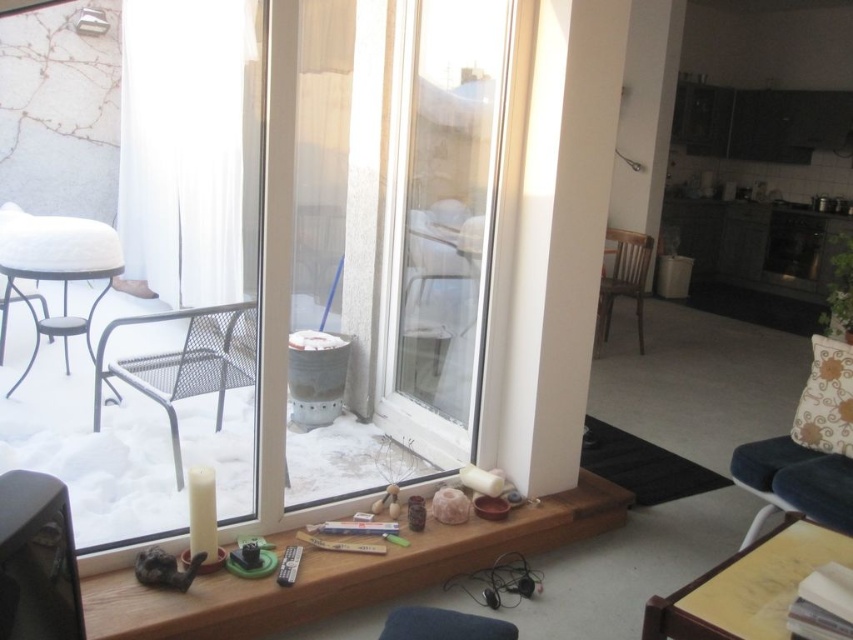
Who is lower down, velvet blue armchair at right or metal mesh armchair at left?

velvet blue armchair at right

Can you confirm if velvet blue armchair at right is positioned to the left of metal mesh armchair at left?

No, velvet blue armchair at right is not to the left of metal mesh armchair at left.

Who is more distant from viewer, (x=809, y=481) or (x=170, y=392)?

Point (x=170, y=392)

Find the location of a particular element. The height and width of the screenshot is (640, 853). velvet blue armchair at right is located at coordinates (805, 444).

This screenshot has height=640, width=853. Describe the element at coordinates (259, 252) in the screenshot. I see `transparent glass window at center` at that location.

Is transparent glass window at center positioned before wooden chair at center?

Yes, it is.

Measure the distance between transparent glass window at center and camera.

A distance of 6.95 feet exists between transparent glass window at center and camera.

Locate an element on the screen. transparent glass window at center is located at coordinates (259, 252).

Measure the distance between point (770, 513) and camera.

They are 8.36 feet apart.

In order to click on velvet blue armchair at right in this screenshot , I will do `click(805, 444)`.

Does point (825, 356) come in front of point (625, 280)?

Yes, point (825, 356) is closer to viewer.

Identify the location of velvet blue armchair at right. Image resolution: width=853 pixels, height=640 pixels. (805, 444).